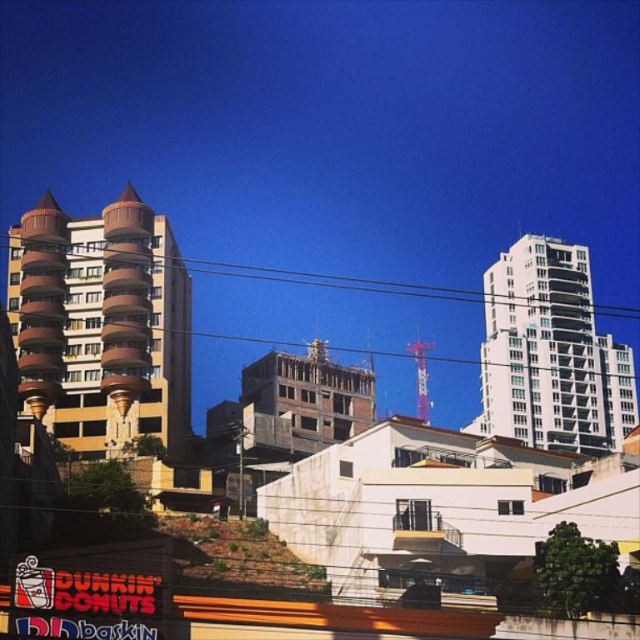
You are standing in the urban landscape and want to determine which of the two points, point (150, 300) or point (561, 435), is nearer to you. Based on the scene description, which point is closer?

Point (150, 300) is closer to the viewer than point (561, 435).